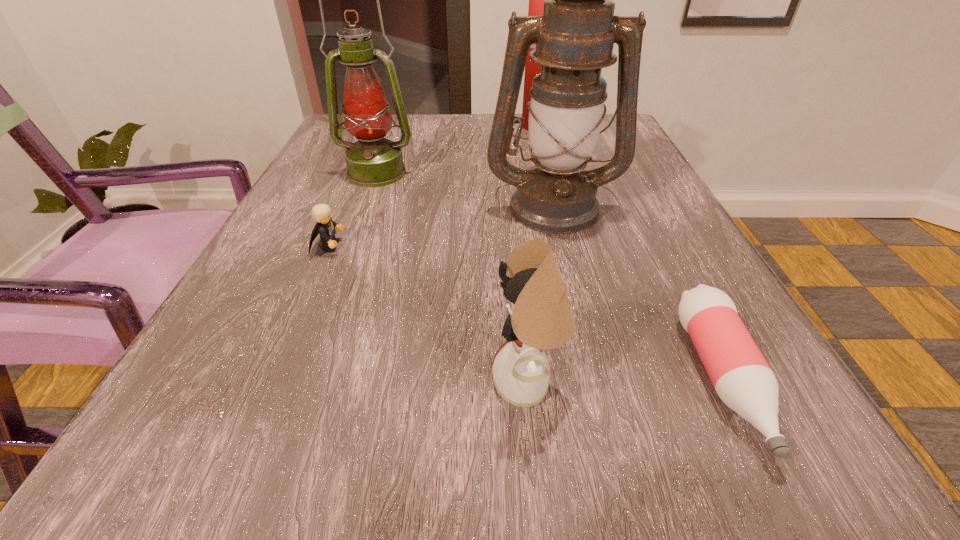
At what (x,y) coordinates should I click in order to perform the action: click on oil lamp located at the right edge. Please return your answer as a coordinate pair (x, y). The width and height of the screenshot is (960, 540). Looking at the image, I should click on (575, 36).

Where is `bottle that is at the right edge`? This screenshot has width=960, height=540. bottle that is at the right edge is located at coordinates (741, 376).

In order to click on object present at the near right corner in this screenshot , I will do `click(741, 376)`.

In the image, there is a desktop. Where is `free region at the far edge`? This screenshot has width=960, height=540. free region at the far edge is located at coordinates (430, 136).

Find the location of a particular element. vacant region at the near edge is located at coordinates (506, 497).

At what (x,y) coordinates should I click in order to perform the action: click on free space at the left edge. Please return your answer as a coordinate pair (x, y). Image resolution: width=960 pixels, height=540 pixels. Looking at the image, I should click on (345, 267).

At what (x,y) coordinates should I click in order to perform the action: click on vacant space at the right edge. Please return your answer as a coordinate pair (x, y). The width and height of the screenshot is (960, 540). Looking at the image, I should click on (676, 303).

At what (x,y) coordinates should I click in order to perform the action: click on vacant region at the near right corner. Please return your answer as a coordinate pair (x, y). Looking at the image, I should click on [x=701, y=486].

Where is `empty location between the Lego and the left oil lamp`? empty location between the Lego and the left oil lamp is located at coordinates (352, 210).

Locate an element on the screen. Image resolution: width=960 pixels, height=540 pixels. free space that is in between the fifth tallest object and the third shortest object is located at coordinates (428, 315).